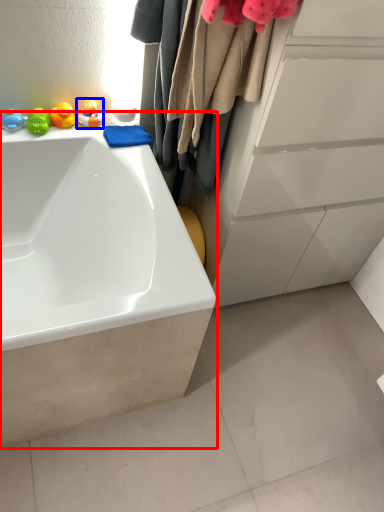
Question: Which of the following is the farthest to the observer, bathtub (highlighted by a red box) or toy (highlighted by a blue box)?

Choices:
 (A) bathtub
 (B) toy

Answer: (B)